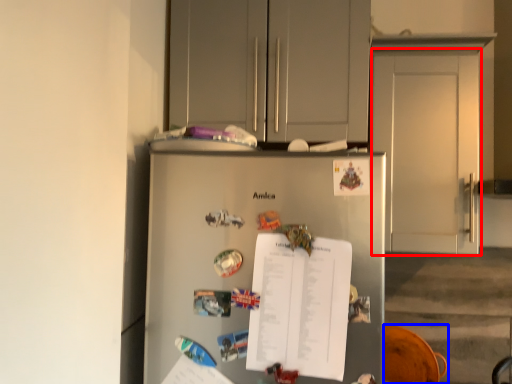
Question: Among these objects, which one is farthest to the camera, door (highlighted by a red box) or swivel chair (highlighted by a blue box)?

Choices:
 (A) door
 (B) swivel chair

Answer: (B)